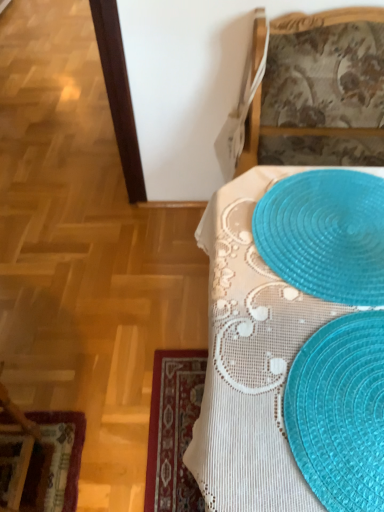
Identify the location of vacant space behind velvet burgundy placemat at lower left. (x=64, y=377).